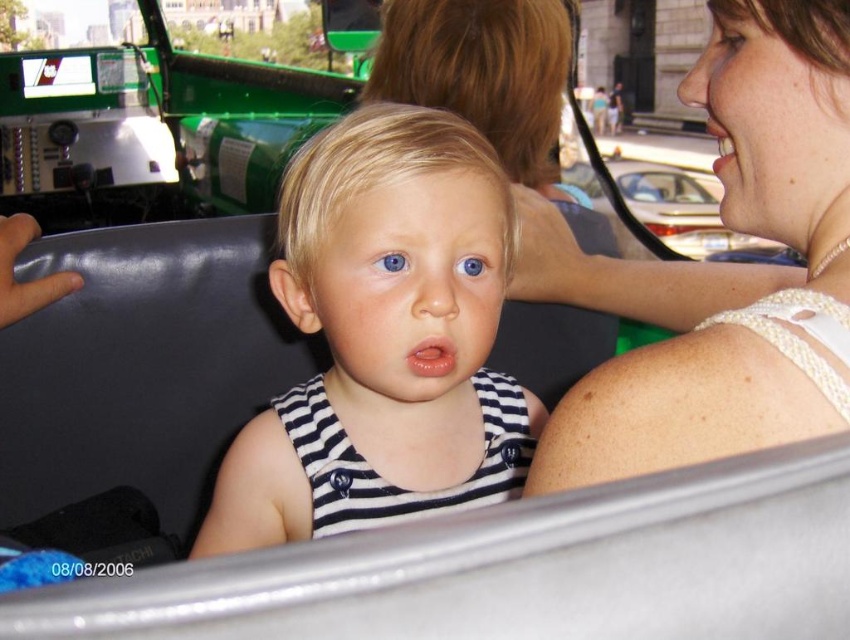
Can you confirm if pearl-like fabric top at upper right is positioned below blue matte eye at center?

Yes.

Who is taller, pearl-like fabric top at upper right or blue matte eye at center?

pearl-like fabric top at upper right

The height and width of the screenshot is (640, 850). What do you see at coordinates (757, 289) in the screenshot?
I see `pearl-like fabric top at upper right` at bounding box center [757, 289].

Where is `pearl-like fabric top at upper right`? The height and width of the screenshot is (640, 850). pearl-like fabric top at upper right is located at coordinates (757, 289).

Is pearl-like fabric top at upper right smaller than blue smooth eye at center?

Incorrect, pearl-like fabric top at upper right is not smaller in size than blue smooth eye at center.

Can you confirm if pearl-like fabric top at upper right is positioned below blue smooth eye at center?

Indeed, pearl-like fabric top at upper right is positioned under blue smooth eye at center.

The height and width of the screenshot is (640, 850). What do you see at coordinates (757, 289) in the screenshot? I see `pearl-like fabric top at upper right` at bounding box center [757, 289].

Find the location of a particular element. Image resolution: width=850 pixels, height=640 pixels. pearl-like fabric top at upper right is located at coordinates (757, 289).

Which is more to the left, pearl-like fabric top at upper right or metallic silver car at upper right?

Positioned to the left is pearl-like fabric top at upper right.

Consider the image. Between pearl-like fabric top at upper right and metallic silver car at upper right, which one has more height?

metallic silver car at upper right

Where is `pearl-like fabric top at upper right`? pearl-like fabric top at upper right is located at coordinates (757, 289).